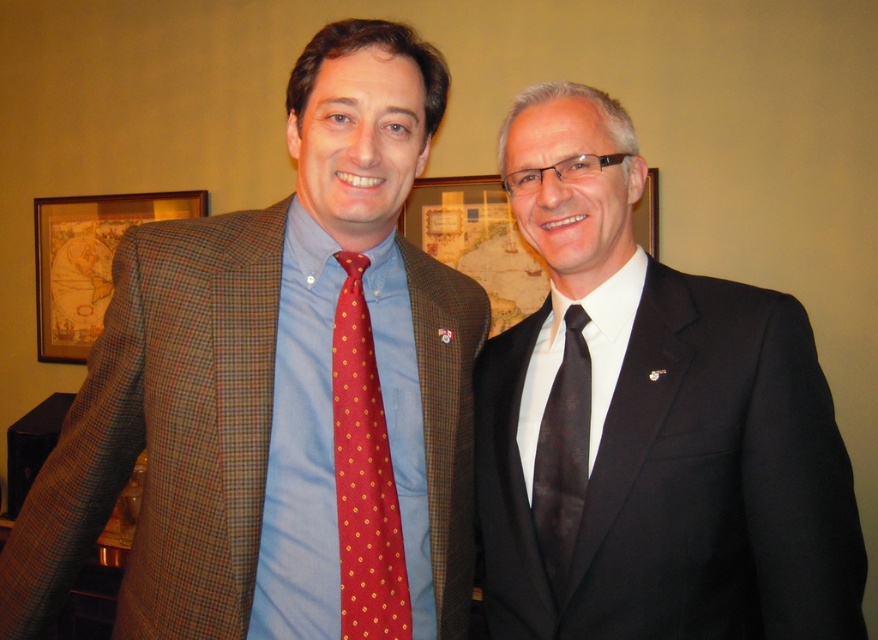
Question: Which point is closer to the camera?

Choices:
 (A) (560, 588)
 (B) (697, 488)
 (C) (481, 209)

Answer: (B)

Question: Observing the image, what is the correct spatial positioning of matte black suit at right in reference to black silk tie at right?

Choices:
 (A) left
 (B) right

Answer: (B)

Question: Which point is closer to the camera?

Choices:
 (A) (602, 515)
 (B) (435, 227)
 (C) (285, 566)

Answer: (C)

Question: Where is matte black suit at right located in relation to red dotted tie at left in the image?

Choices:
 (A) above
 (B) below

Answer: (A)

Question: Is matte plaid blazer at left closer to camera compared to matte black suit at right?

Choices:
 (A) yes
 (B) no

Answer: (B)

Question: Estimate the real-world distances between objects in this image. Which object is closer to the matte black suit at right?

Choices:
 (A) black glossy suit at right
 (B) black silk tie at right

Answer: (B)